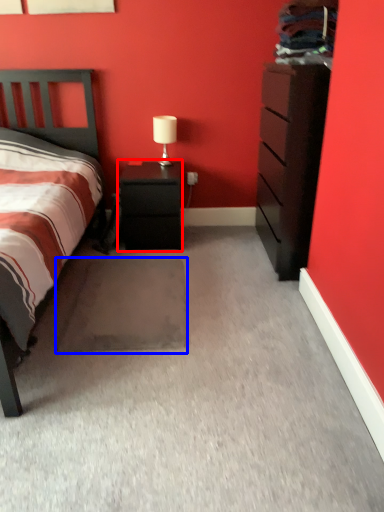
Question: Which object appears closest to the camera in this image, nightstand (highlighted by a red box) or footrest (highlighted by a blue box)?

Choices:
 (A) nightstand
 (B) footrest

Answer: (B)